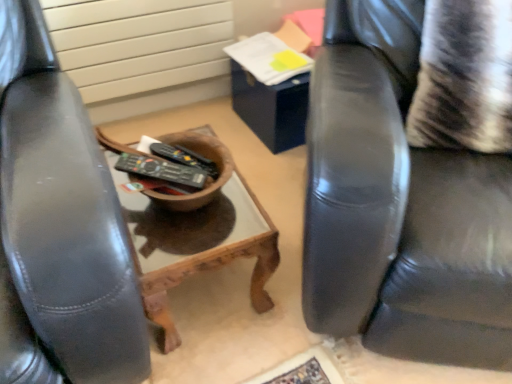
Question: Is black plastic remote control at center, which is the first remote control from front to back, not close to white textured radiator at upper left?

Choices:
 (A) no
 (B) yes

Answer: (A)

Question: Can you confirm if black plastic remote control at center, which ranks as the 2th remote control in back-to-front order, is wider than white textured radiator at upper left?

Choices:
 (A) yes
 (B) no

Answer: (A)

Question: Is the position of black plastic remote control at center, which is the first remote control from front to back, more distant than that of white textured radiator at upper left?

Choices:
 (A) yes
 (B) no

Answer: (B)

Question: Is white textured radiator at upper left a part of black plastic remote control at center, which ranks as the 2th remote control in back-to-front order?

Choices:
 (A) no
 (B) yes

Answer: (A)

Question: Considering the relative sizes of black plastic remote control at center, which is the first remote control from front to back, and white textured radiator at upper left in the image provided, is black plastic remote control at center, which is the first remote control from front to back, thinner than white textured radiator at upper left?

Choices:
 (A) no
 (B) yes

Answer: (A)

Question: In terms of size, does black leather chair at right appear bigger or smaller than black plastic remote control at center, the second remote control in the front-to-back sequence?

Choices:
 (A) small
 (B) big

Answer: (B)

Question: Is black leather chair at right spatially inside black plastic remote control at center, the second remote control in the front-to-back sequence, or outside of it?

Choices:
 (A) inside
 (B) outside

Answer: (B)

Question: Considering the positions of black leather chair at right and black plastic remote control at center, the 1th remote control in the back-to-front sequence, in the image, is black leather chair at right wider or thinner than black plastic remote control at center, the 1th remote control in the back-to-front sequence,?

Choices:
 (A) wide
 (B) thin

Answer: (A)

Question: From a real-world perspective, relative to black plastic remote control at center, the 1th remote control in the back-to-front sequence, is black leather chair at right vertically above or below?

Choices:
 (A) below
 (B) above

Answer: (B)

Question: From a real-world perspective, relative to black plastic remote control at center, the 1th remote control in the back-to-front sequence, is white textured radiator at upper left vertically above or below?

Choices:
 (A) below
 (B) above

Answer: (A)

Question: Do you think white textured radiator at upper left is within black plastic remote control at center, the second remote control in the front-to-back sequence, or outside of it?

Choices:
 (A) inside
 (B) outside

Answer: (B)

Question: In terms of size, does white textured radiator at upper left appear bigger or smaller than black plastic remote control at center, the second remote control in the front-to-back sequence?

Choices:
 (A) small
 (B) big

Answer: (B)

Question: Does point (169, 74) appear closer or farther from the camera than point (161, 152)?

Choices:
 (A) closer
 (B) farther

Answer: (B)

Question: From a real-world perspective, is striped fabric pillow at right positioned above or below black plastic remote control at center, the second remote control in the front-to-back sequence?

Choices:
 (A) below
 (B) above

Answer: (B)

Question: Considering the positions of striped fabric pillow at right and black plastic remote control at center, the 1th remote control in the back-to-front sequence, in the image, is striped fabric pillow at right bigger or smaller than black plastic remote control at center, the 1th remote control in the back-to-front sequence,?

Choices:
 (A) small
 (B) big

Answer: (B)